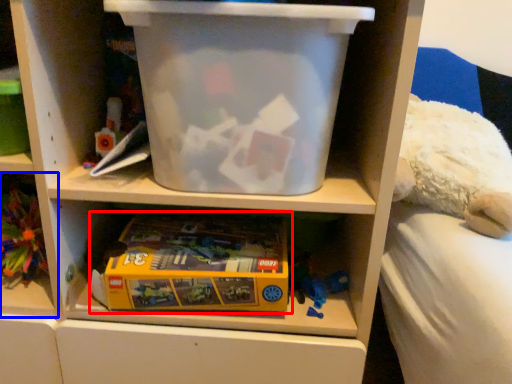
Question: Among these objects, which one is farthest to the camera, toy (highlighted by a red box) or shelf (highlighted by a blue box)?

Choices:
 (A) toy
 (B) shelf

Answer: (B)